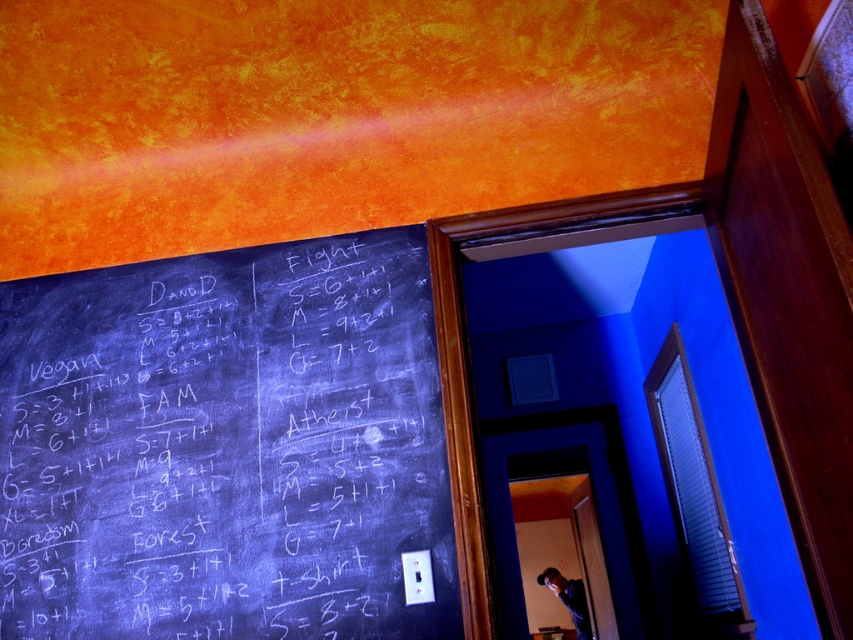
Question: Which object is farther from the camera taking this photo?

Choices:
 (A) matte black shirt at center
 (B) black chalkboard at left

Answer: (A)

Question: From the image, what is the correct spatial relationship of black chalkboard at left in relation to matte black shirt at center?

Choices:
 (A) left
 (B) right

Answer: (A)

Question: Can you confirm if black chalkboard at left is bigger than matte black shirt at center?

Choices:
 (A) yes
 (B) no

Answer: (A)

Question: Is black chalkboard at left above matte black shirt at center?

Choices:
 (A) no
 (B) yes

Answer: (B)

Question: Among these points, which one is farthest from the camera?

Choices:
 (A) (543, 573)
 (B) (181, 362)

Answer: (A)